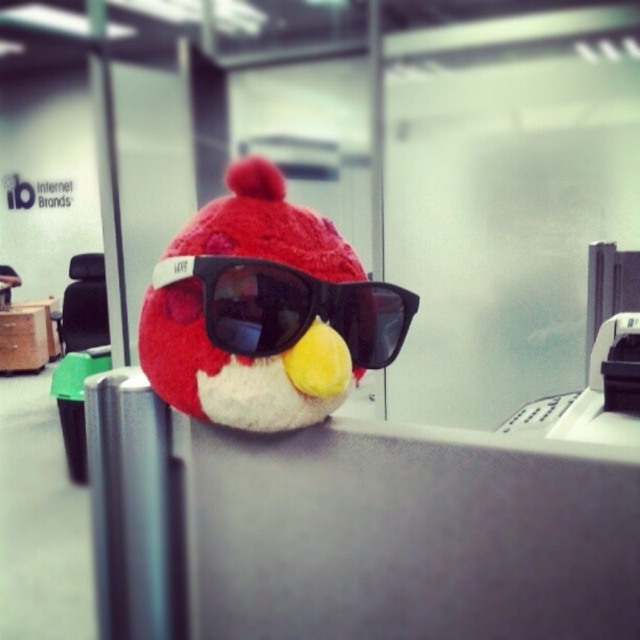
You are an office worker who wants to place a new pair of sunglasses on your desk. The matte plush toy at center is already occupying space. Can the black matte sunglasses at center be placed 2.5 centimeters away from the plush toy without overlapping?

The distance between the matte plush toy at center and the black matte sunglasses at center is currently 2.25 centimeters. Since 2.25 cm is less than the desired 2.5 cm, moving the sunglasses to achieve the 2.5 cm separation would require adjusting their position.

You are organizing an office desk and need to place a new item at coordinates 0.5, 0.4. Is there enough space at that location for the matte plush toy at center?

The matte plush toy at center is already located at point (264, 310), which is very close to the desired coordinates (256, 320). However, since the exact coordinates might require precise placement, there may not be enough space if the toy is already occupying that area.

You are an office worker who wants to place a new pair of sunglasses on your desk. You have the matte plush toy at center and the black matte sunglasses at center. Which object should you move to make space for the new sunglasses?

The matte plush toy at center is positioned over black matte sunglasses at center, so you should move the matte plush toy at center to access the area where the sunglasses are placed.